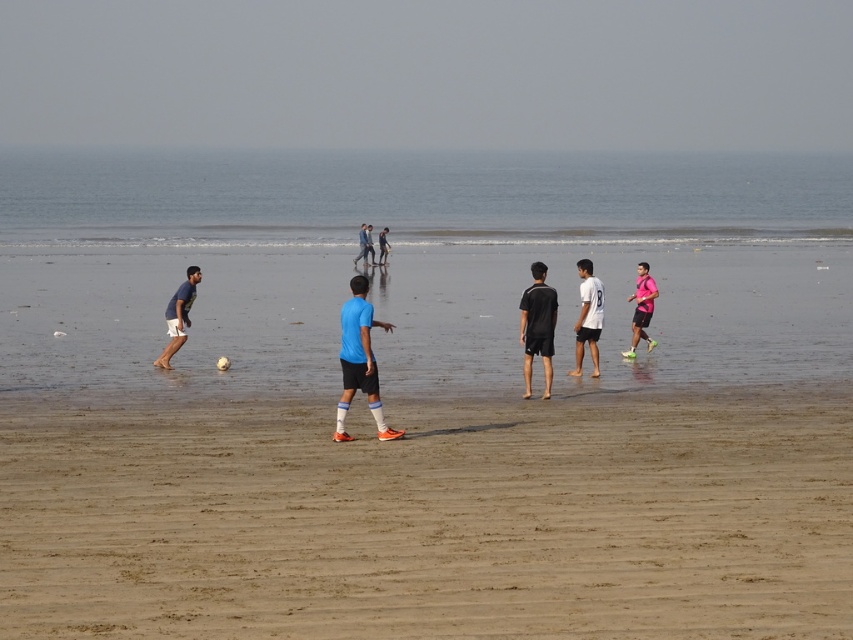
Question: Which point is farther to the camera?

Choices:
 (A) (543, 307)
 (B) (579, 308)
 (C) (631, 330)
 (D) (370, 243)

Answer: (D)

Question: Does black matte shorts at center appear on the left side of blue fabric pants at center?

Choices:
 (A) no
 (B) yes

Answer: (A)

Question: Which point is closer to the camera?

Choices:
 (A) white matte shirt at center
 (B) pink matte shirt at right

Answer: (A)

Question: Which of the following is the closest to the observer?

Choices:
 (A) brown sandy beach at center
 (B) black matte shorts at center
 (C) blue matte soccer ball at center

Answer: (A)

Question: Does black matte shorts at center appear on the left side of blue fabric pants at center?

Choices:
 (A) no
 (B) yes

Answer: (A)

Question: Can you confirm if white matte shirt at center is bigger than blue fabric pants at center?

Choices:
 (A) no
 (B) yes

Answer: (A)